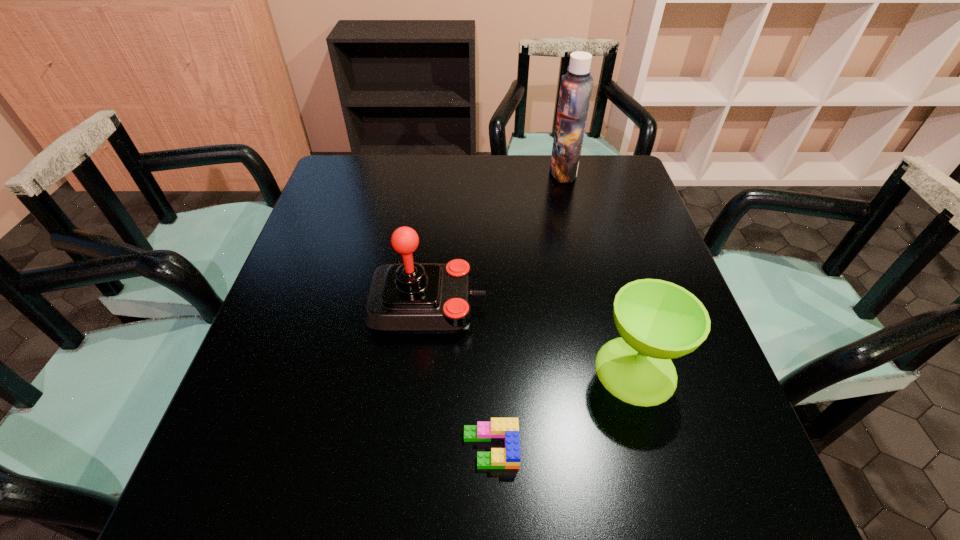
Where is `blank region between the Lego and the third shortest object`? blank region between the Lego and the third shortest object is located at coordinates (459, 377).

Find the location of a particular element. This screenshot has height=540, width=960. free space between the wineglass and the shortest object is located at coordinates (564, 409).

At what (x,y) coordinates should I click in order to perform the action: click on vacant space that is in between the Lego and the second shortest object. Please return your answer as a coordinate pair (x, y). Looking at the image, I should click on (564, 409).

At what (x,y) coordinates should I click in order to perform the action: click on object that is the closest to the joystick. Please return your answer as a coordinate pair (x, y). This screenshot has width=960, height=540. Looking at the image, I should click on (506, 430).

At what (x,y) coordinates should I click in order to perform the action: click on the closest object relative to the second shortest object. Please return your answer as a coordinate pair (x, y). Looking at the image, I should click on (506, 430).

Locate an element on the screen. Image resolution: width=960 pixels, height=540 pixels. free space that satisfies the following two spatial constraints: 1. on the back side of the shortest object; 2. on the base of the joystick is located at coordinates (489, 305).

Find the location of a particular element. The width and height of the screenshot is (960, 540). free region that satisfies the following two spatial constraints: 1. on the back side of the second shortest object; 2. on the left side of the Lego is located at coordinates (490, 370).

You are a GUI agent. You are given a task and a screenshot of the screen. Output one action in this format:
    pyautogui.click(x=<x>, y=<y>)
    Task: Click on the free spot that satisfies the following two spatial constraints: 1. on the back side of the third tallest object; 2. on the base of the joystick
    The height and width of the screenshot is (540, 960).
    Given the screenshot: What is the action you would take?
    pyautogui.click(x=617, y=305)

At what (x,y) coordinates should I click in order to perform the action: click on free point that satisfies the following two spatial constraints: 1. on the base of the joystick; 2. on the back side of the wineglass. Please return your answer as a coordinate pair (x, y). The width and height of the screenshot is (960, 540). Looking at the image, I should click on [x=420, y=370].

Find the location of a particular element. The width and height of the screenshot is (960, 540). free location that satisfies the following two spatial constraints: 1. on the base of the wineglass; 2. on the right side of the joystick is located at coordinates [x=420, y=370].